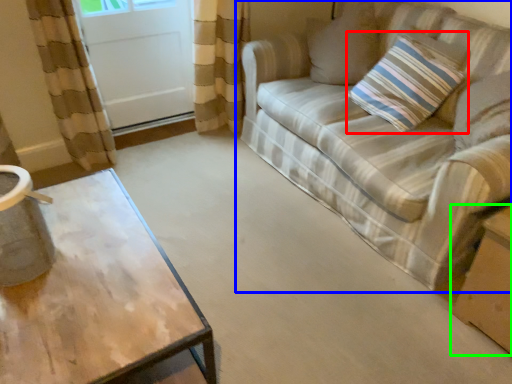
Question: Estimate the real-world distances between objects in this image. Which object is closer to pillow (highlighted by a red box), studio couch (highlighted by a blue box) or cardboard box (highlighted by a green box)?

Choices:
 (A) studio couch
 (B) cardboard box

Answer: (A)